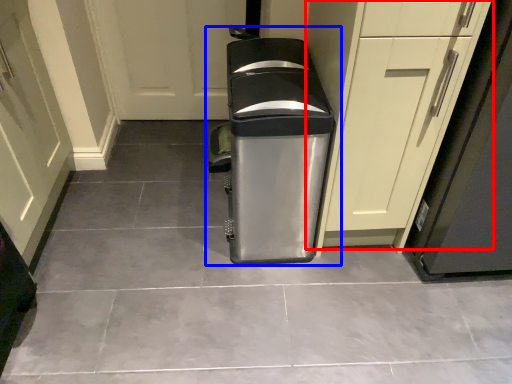
Question: Among these objects, which one is farthest to the camera, cabinetry (highlighted by a red box) or waste container (highlighted by a blue box)?

Choices:
 (A) cabinetry
 (B) waste container

Answer: (B)